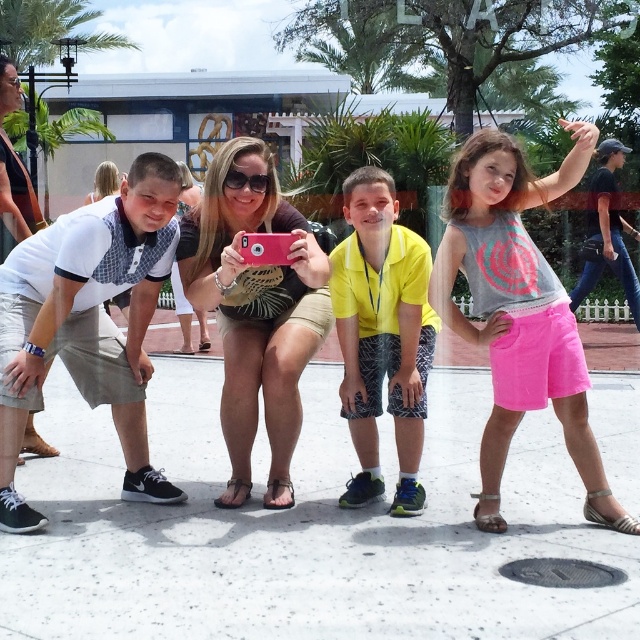
Consider the image. You are a photographer trying to capture a group photo. You notice two items in the scene that could potentially block the sunlight entering your camera lens. The pink cotton shorts at center and the denim jeans at upper right. Which item is more likely to cast a shadow on the lens if positioned between the sun and the camera?

The pink cotton shorts at center are wider than the denim jeans at upper right, so they are more likely to cast a larger shadow and block the sunlight entering the camera lens.